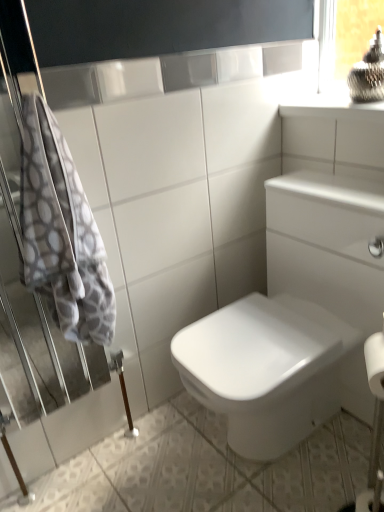
Question: Considering the positions of clear glass window frame at upper right and white textured towel at left in the image, is clear glass window frame at upper right wider or thinner than white textured towel at left?

Choices:
 (A) wide
 (B) thin

Answer: (B)

Question: Is clear glass window frame at upper right taller or shorter than white textured towel at left?

Choices:
 (A) short
 (B) tall

Answer: (A)

Question: Which object is positioned closest to the white glossy ceramic tile at center?

Choices:
 (A) clear glass window frame at upper right
 (B) white textured towel at left

Answer: (B)

Question: Which of these objects is positioned closest to the clear glass window frame at upper right?

Choices:
 (A) white textured towel at left
 (B) white glossy ceramic tile at center

Answer: (A)